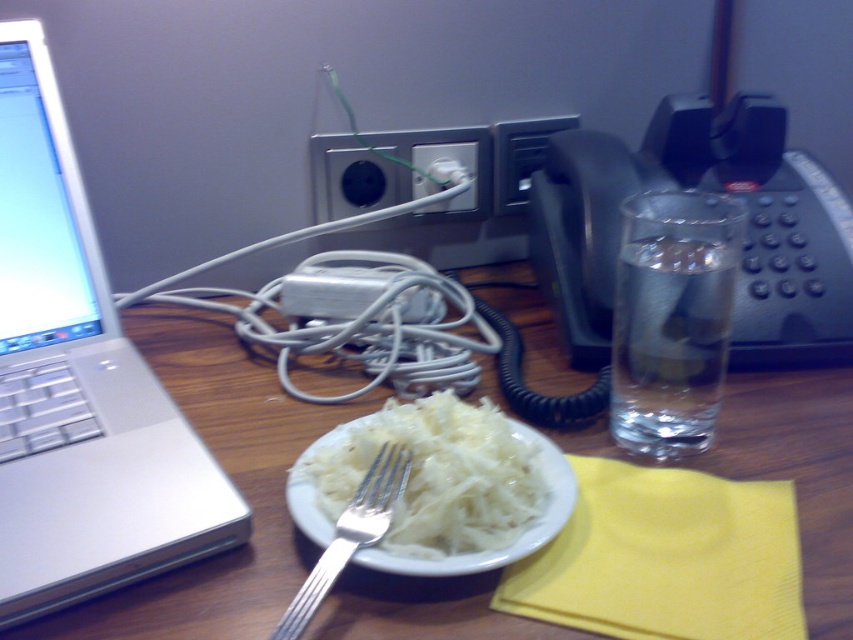
You are organizing items on a desk and need to place a new item between the black plastic phone at right and the white shredded food at center. Is there enough space for the new item?

The black plastic phone at right is to the right of white shredded food at center, so there is space between them to place the new item.

You have a task to place a new object on the desk. The object is the size of the white shredded food at center. Where on the desk can you place it without overlapping the silver metallic laptop at left?

Since the silver metallic laptop at left is bigger than the white shredded food at center, you can place the new object in an area that is not occupied by the larger laptop, such as to the right of the laptop or near the edge of the desk where there is space available.